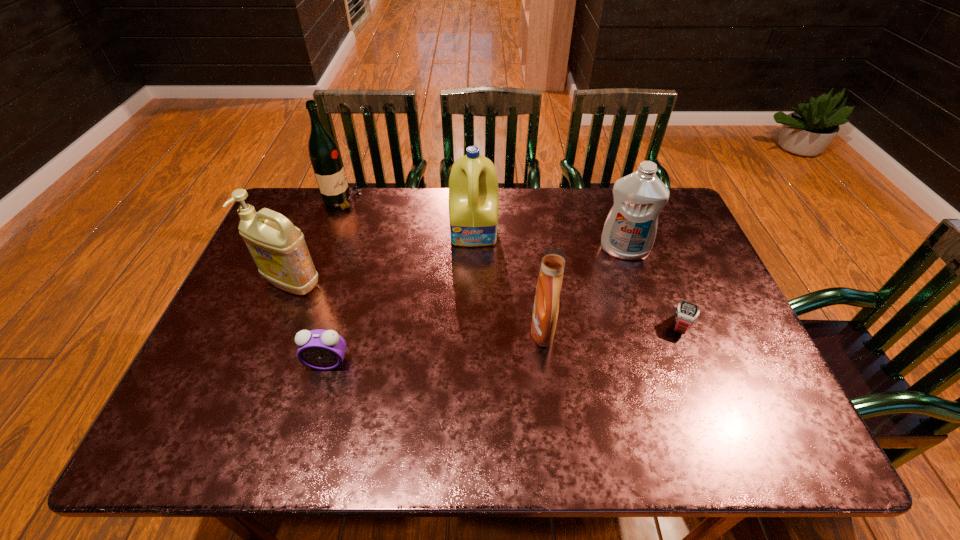
Locate an element on the screen. the farthest object is located at coordinates pos(324,154).

Identify the location of the rightmost detergent. (629, 232).

This screenshot has width=960, height=540. Find the location of `the fourth object from left to right`. the fourth object from left to right is located at coordinates (473, 185).

What are the coordinates of `the third farthest detergent` in the screenshot? It's located at (278, 248).

In order to click on the leftmost detergent in this screenshot , I will do `click(278, 248)`.

Where is `the third detergent from left to right`? the third detergent from left to right is located at coordinates (546, 304).

Identify the location of the nearest detergent. (546, 304).

At what (x,y) coordinates should I click in order to perform the action: click on alarm clock. Please return your answer as a coordinate pair (x, y). The image size is (960, 540). Looking at the image, I should click on (324, 350).

Where is `the nearest object`? The height and width of the screenshot is (540, 960). the nearest object is located at coordinates (324, 350).

Find the location of `watch`. watch is located at coordinates (686, 313).